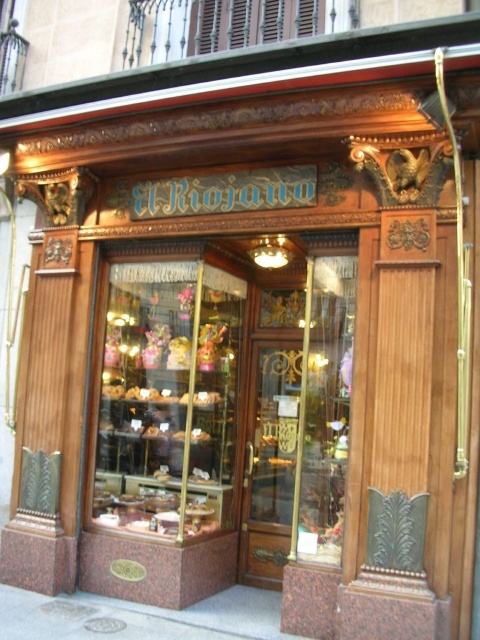
Question: Which point is farther to the camera?

Choices:
 (A) shiny glass display case at center
 (B) gold polished wood door at center
 (C) marble-like glass display case at center

Answer: (B)

Question: Observing the image, what is the correct spatial positioning of shiny glass display case at center in reference to gold polished wood door at center?

Choices:
 (A) below
 (B) above

Answer: (B)

Question: Which point is farther to the camera?

Choices:
 (A) gold polished wood door at center
 (B) marble-like glass display case at center
 (C) shiny glass display case at center

Answer: (A)

Question: Estimate the real-world distances between objects in this image. Which object is closer to the shiny glass display case at center?

Choices:
 (A) marble-like glass display case at center
 (B) gold polished wood door at center

Answer: (A)

Question: Is marble-like glass display case at center behind shiny glass display case at center?

Choices:
 (A) yes
 (B) no

Answer: (B)

Question: Does marble-like glass display case at center have a smaller size compared to shiny glass display case at center?

Choices:
 (A) no
 (B) yes

Answer: (A)